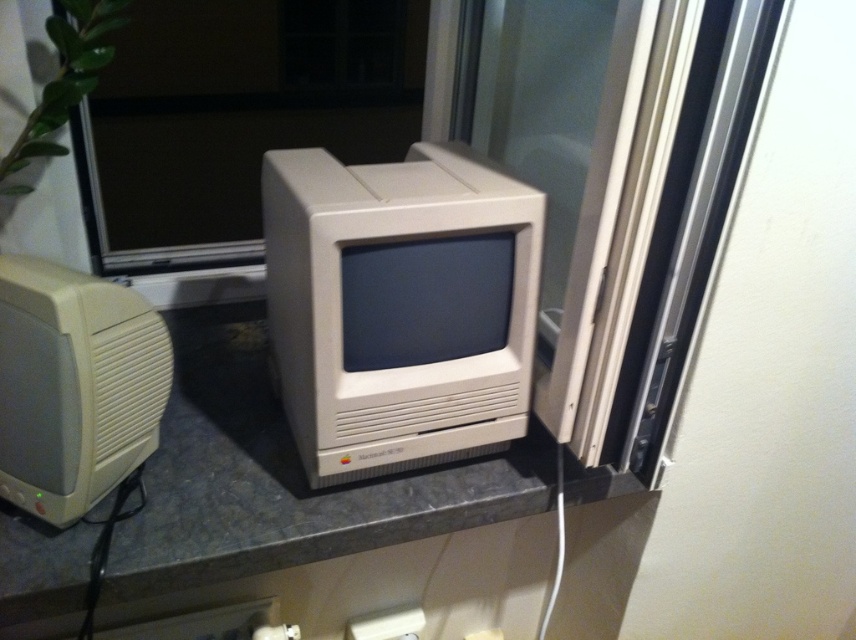
Does white plastic computer monitor at center appear under beige plastic desktop computer at left?

No, white plastic computer monitor at center is not below beige plastic desktop computer at left.

Which is behind, point (390, 448) or point (96, 387)?

The point (390, 448) is behind.

Between point (284, 186) and point (64, 355), which one is positioned behind?

Point (284, 186)

Find the location of a particular element. The height and width of the screenshot is (640, 856). white plastic computer monitor at center is located at coordinates (399, 307).

Is matte gray countertop at center taller than beige plastic desktop computer at left?

Yes.

Can you confirm if matte gray countertop at center is thinner than beige plastic desktop computer at left?

No, matte gray countertop at center is not thinner than beige plastic desktop computer at left.

Between point (9, 576) and point (94, 348), which one is positioned in front?

Point (94, 348)

Locate an element on the screen. The image size is (856, 640). matte gray countertop at center is located at coordinates (282, 477).

Consider the image. Between beige plastic desktop computer at left and white plastic electric outlet at lower center, which one is positioned higher?

beige plastic desktop computer at left

Is point (113, 312) closer to viewer compared to point (370, 632)?

That is True.

Locate an element on the screen. beige plastic desktop computer at left is located at coordinates (74, 387).